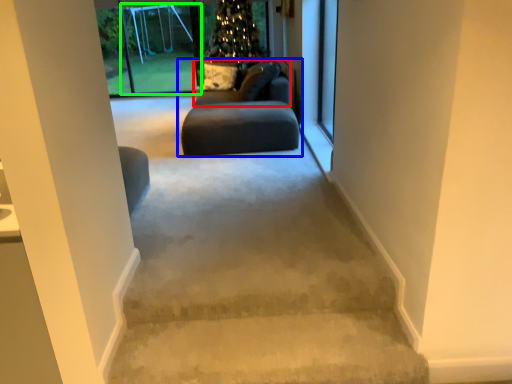
Question: Which object is the closest to the couch (highlighted by a red box)? Choose among these: studio couch (highlighted by a blue box) or screen door (highlighted by a green box).

Choices:
 (A) studio couch
 (B) screen door

Answer: (A)